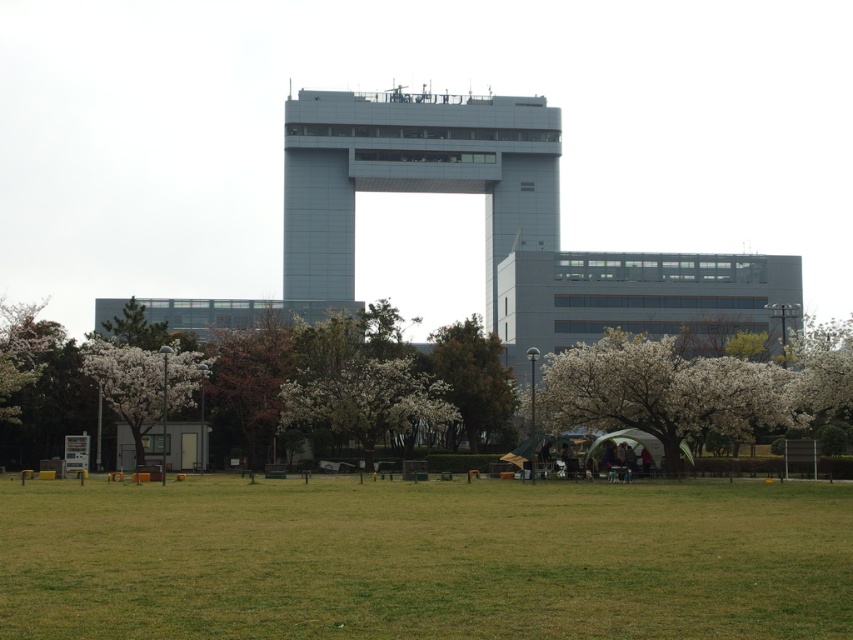
Question: Which point appears farthest from the camera in this image?

Choices:
 (A) (421, 140)
 (B) (488, 356)
 (C) (148, 378)

Answer: (A)

Question: Is white blossoming tree at lower right closer to camera compared to green leafy tree at center?

Choices:
 (A) yes
 (B) no

Answer: (A)

Question: Estimate the real-world distances between objects in this image. Which object is closer to the sleek metallic tower at center?

Choices:
 (A) white matte tree at left
 (B) green leafy tree at center
 (C) green grass at lower center

Answer: (B)

Question: Observing the image, what is the correct spatial positioning of brown textured tree at center in reference to green leafy tree at center?

Choices:
 (A) above
 (B) below

Answer: (A)

Question: Can you confirm if green grass at lower center is thinner than white blossoming tree at lower right?

Choices:
 (A) no
 (B) yes

Answer: (A)

Question: Estimate the real-world distances between objects in this image. Which object is farther from the green grass at lower center?

Choices:
 (A) white blossoming tree at lower right
 (B) white blossoming tree at right

Answer: (B)